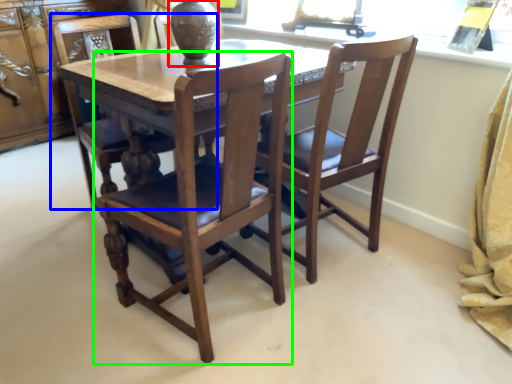
Question: Considering the real-world distances, which object is closest to glass vase (highlighted by a red box)? chair (highlighted by a blue box) or chair (highlighted by a green box).

Choices:
 (A) chair
 (B) chair

Answer: (A)